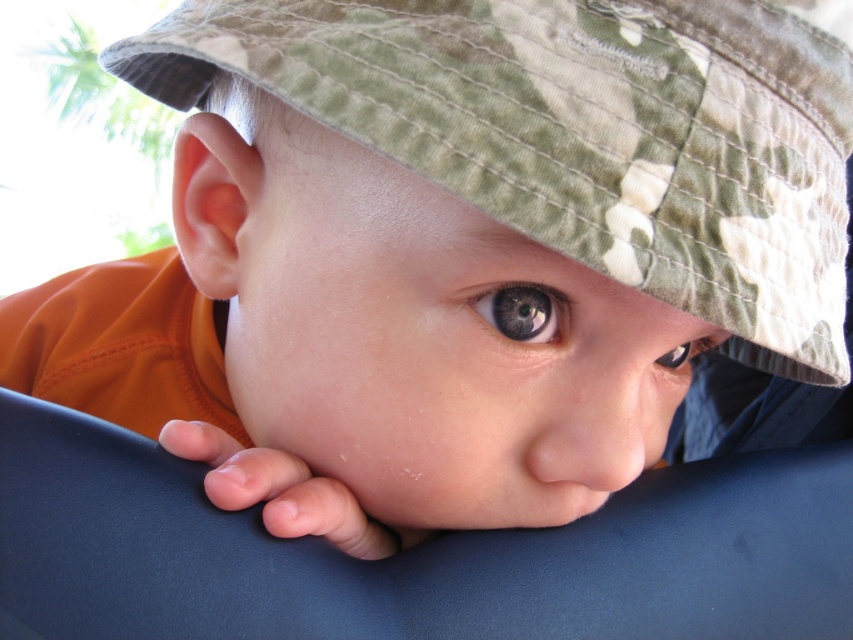
Who is shorter, green matte eye at center or brown matte eye at center?

green matte eye at center

Who is lower down, green matte eye at center or brown matte eye at center?

brown matte eye at center is below.

Does point (531, 337) lie behind point (689, 346)?

No.

I want to click on green matte eye at center, so click(x=521, y=312).